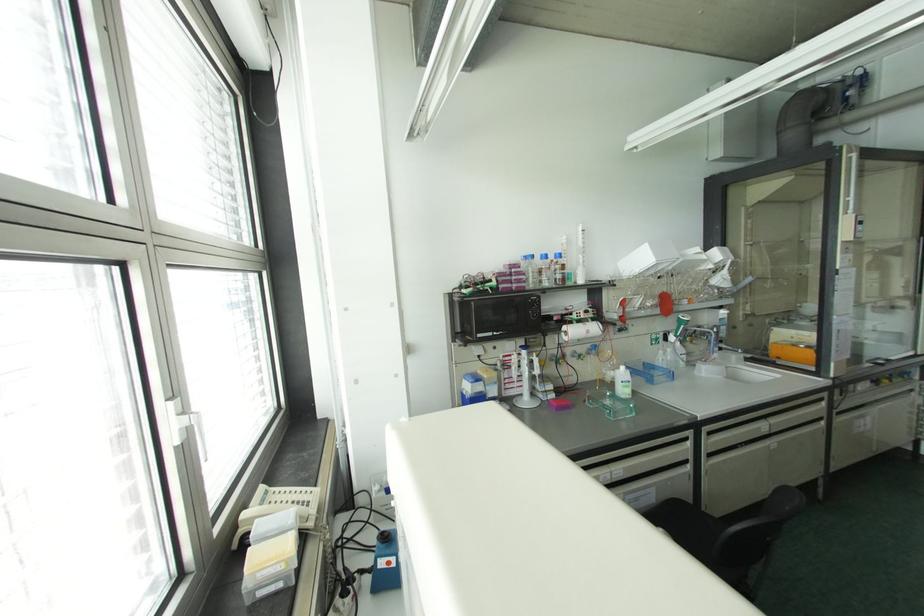
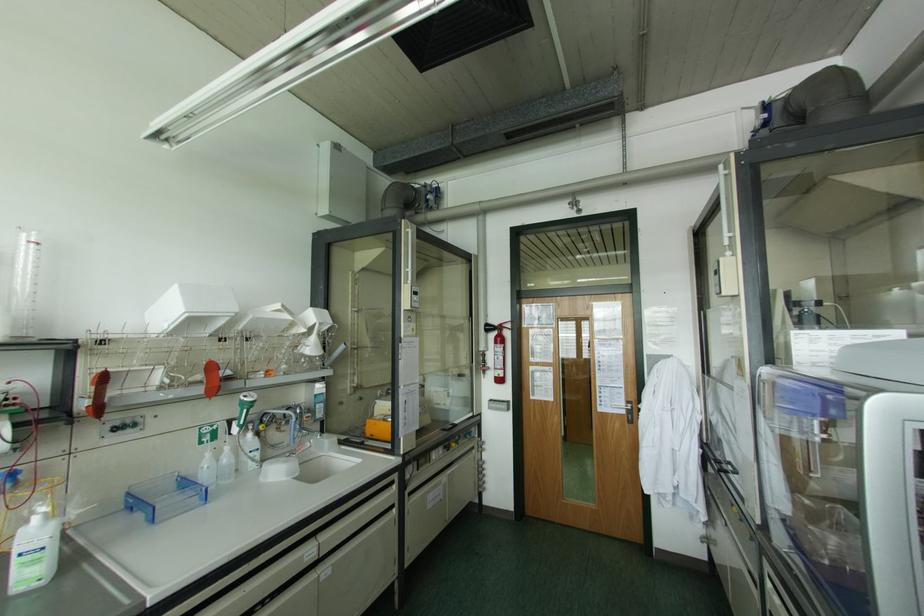
Find the pixel in the second image that matches (x=822, y=402) in the first image.

(394, 485)